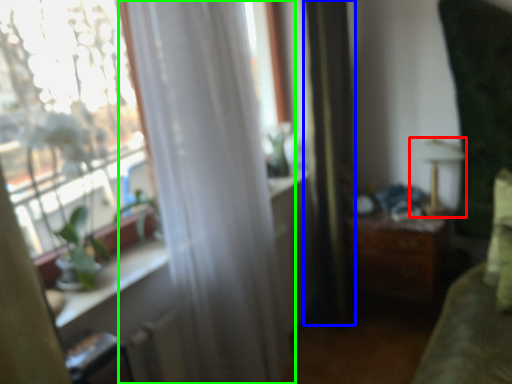
Question: Considering the real-world distances, which object is closest to lamp (highlighted by a red box)? curtain (highlighted by a blue box) or curtain (highlighted by a green box).

Choices:
 (A) curtain
 (B) curtain

Answer: (A)